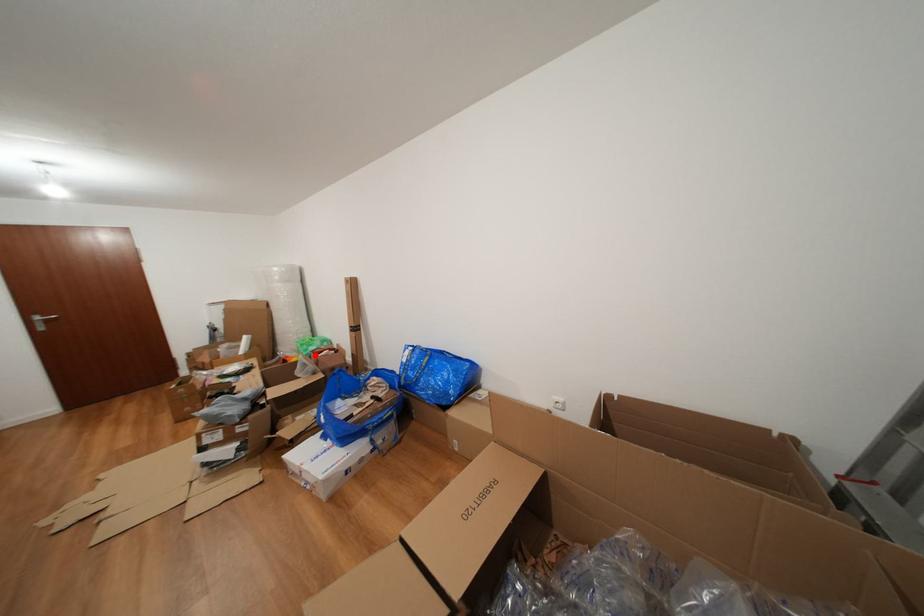
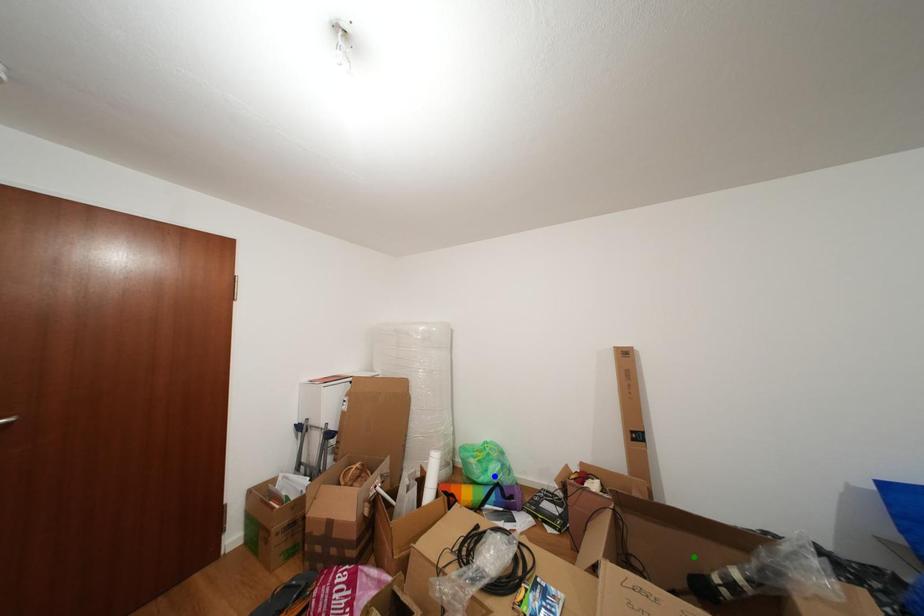
Question: I am providing you with two images of the same scene from different viewpoints. A red point is marked on the first image. You are given multiple points on the second image. Which point in image 2 represents the same 3d spot as the red point in image 1?

Choices:
 (A) yellow point
 (B) blue point
 (C) green point

Answer: (B)